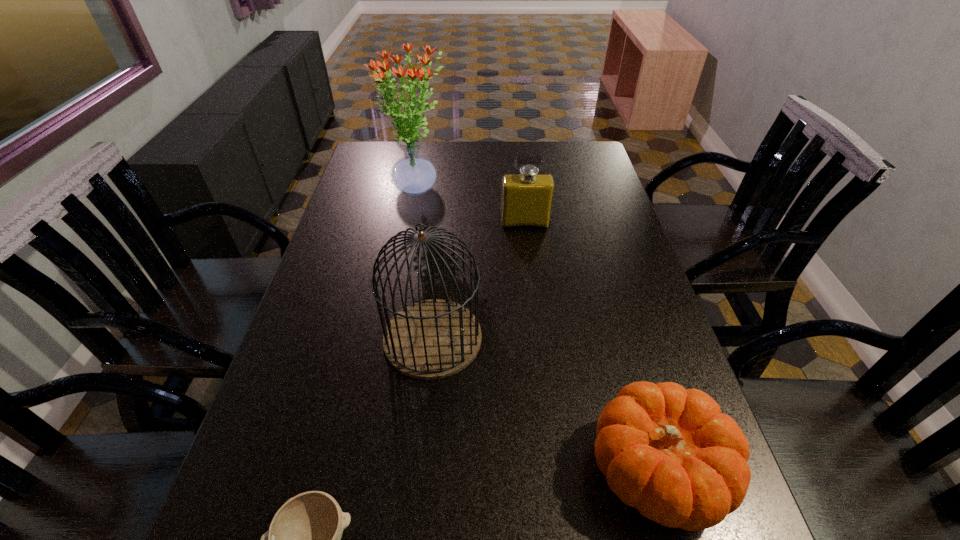
Where is `free point that satisfies the following two spatial constraints: 1. on the front-facing side of the fourth nearest object; 2. at the door of the second tallest object`? free point that satisfies the following two spatial constraints: 1. on the front-facing side of the fourth nearest object; 2. at the door of the second tallest object is located at coordinates (539, 338).